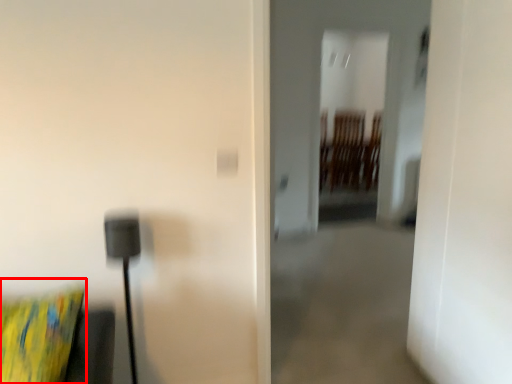
Question: Considering the relative positions of pillow (annotated by the red box) and glass door in the image provided, where is pillow (annotated by the red box) located with respect to the staircase?

Choices:
 (A) left
 (B) right

Answer: (A)